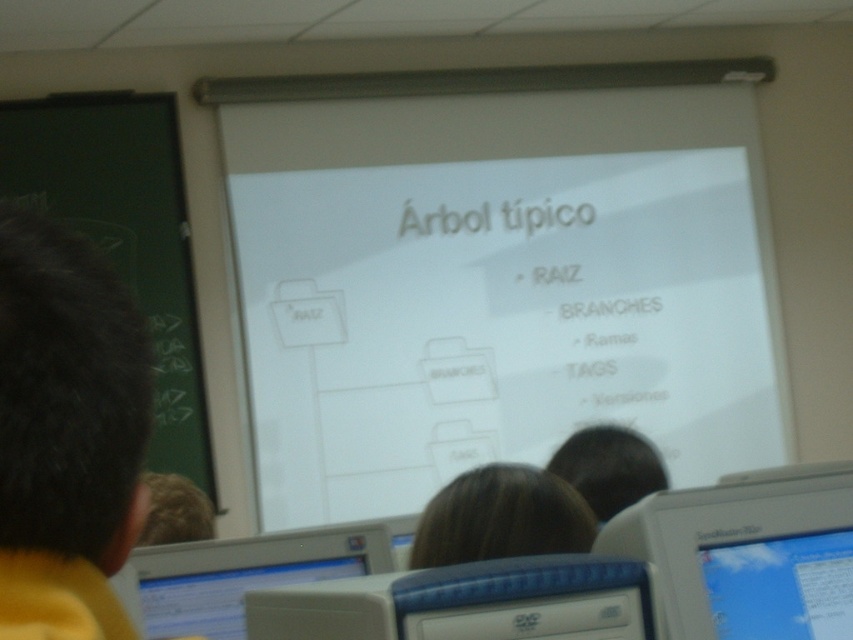
Question: Is blue glossy monitor at lower right above dark brown hair at lower center?

Choices:
 (A) yes
 (B) no

Answer: (A)

Question: Can you confirm if green chalkboard at left is smaller than brown hair at center?

Choices:
 (A) no
 (B) yes

Answer: (A)

Question: Which of the following is the farthest from the observer?

Choices:
 (A) (547, 522)
 (B) (4, 106)
 (C) (784, 611)
 (D) (611, 474)

Answer: (B)

Question: Does white plastic monitor at lower right appear on the left side of brown hair at center?

Choices:
 (A) no
 (B) yes

Answer: (A)

Question: Which point is closer to the camera?

Choices:
 (A) (379, 524)
 (B) (756, 595)
 (C) (491, 508)
 (D) (764, 573)

Answer: (B)

Question: Considering the real-world distances, which object is closest to the green chalkboard at left?

Choices:
 (A) blue glossy monitor at lower right
 (B) white plastic monitor at lower right

Answer: (B)